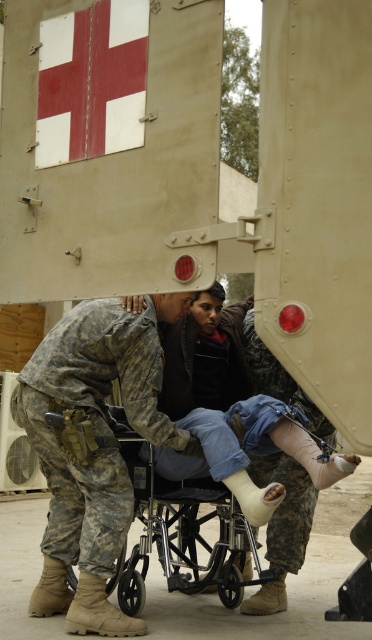
Between camouflage fabric at center and metallic silver wheelchair at center, which one appears on the right side from the viewer's perspective?

Positioned to the right is metallic silver wheelchair at center.

Is camouflage fabric at center below metallic silver wheelchair at center?

No.

In order to click on camouflage fabric at center in this screenshot , I will do (94, 448).